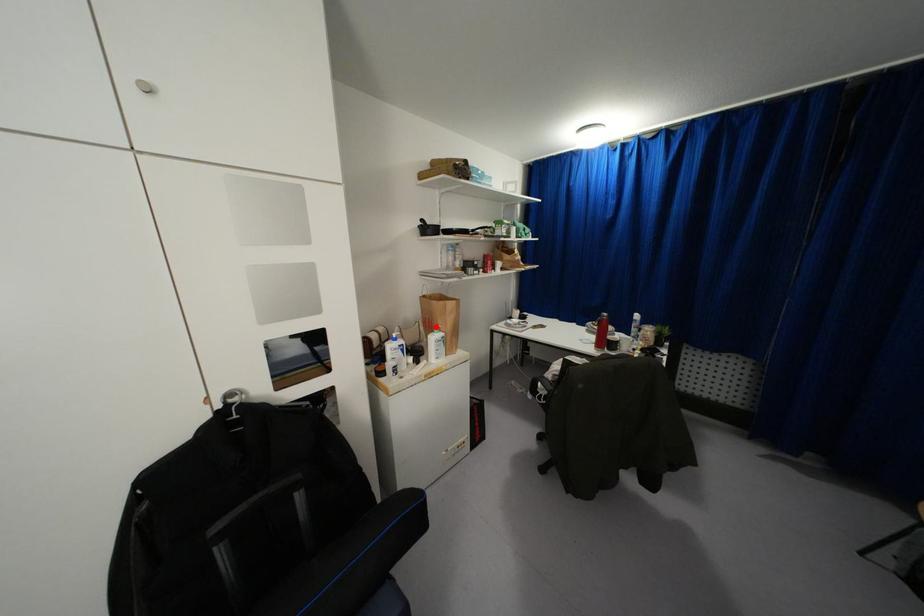
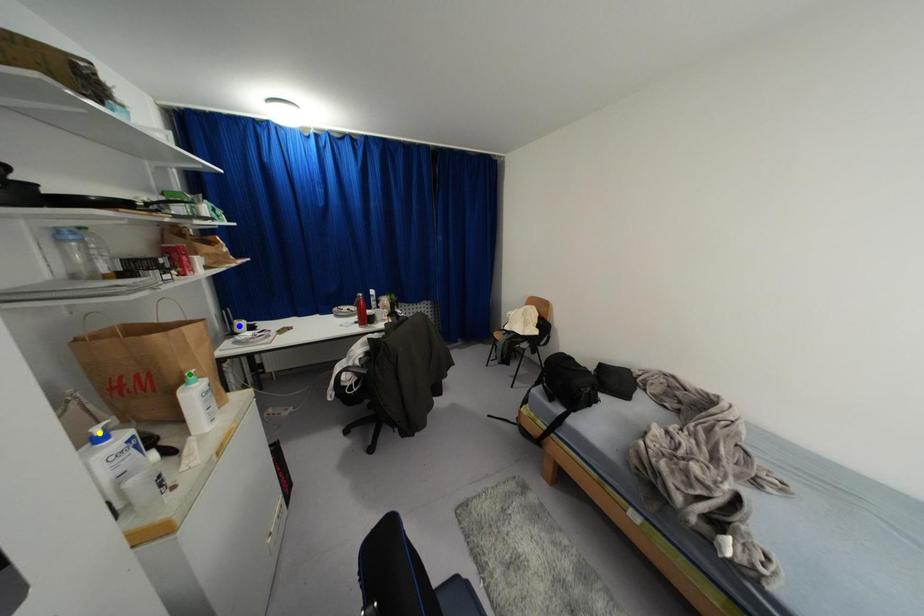
Question: I am providing you with two images of the same scene from different viewpoints. A red point is marked on the first image. You are given multiple points on the second image. Which point in image 2 represents the same 3d spot as the red point in image 1?

Choices:
 (A) yellow point
 (B) blue point
 (C) green point

Answer: (C)